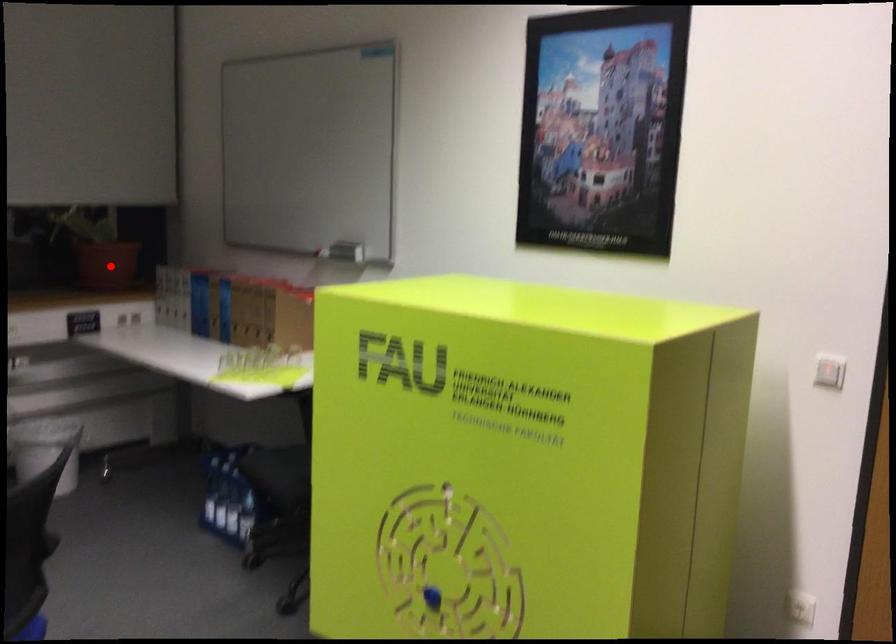
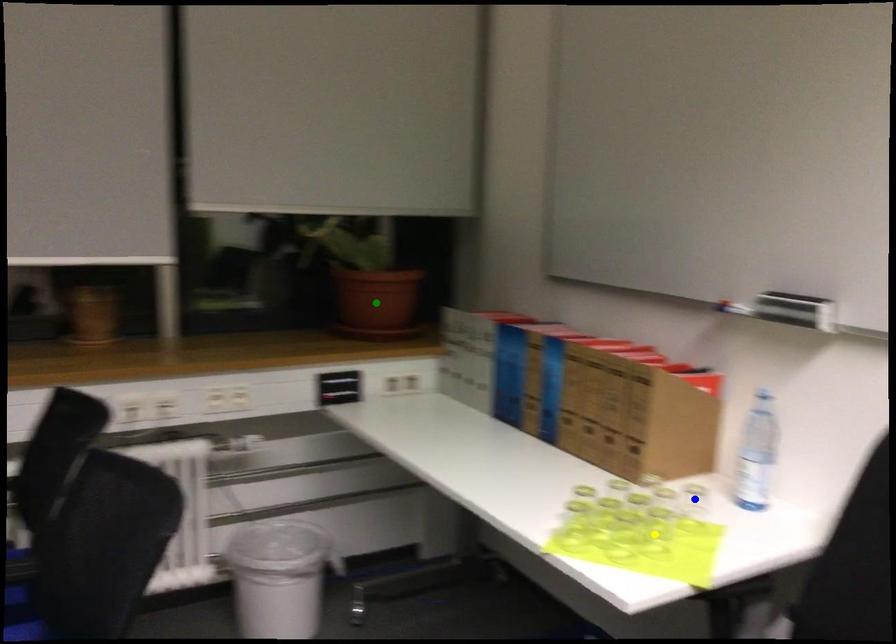
Question: I am providing you with two images of the same scene from different viewpoints. A red point is marked on the first image. You are given multiple points on the second image. In image 2, which mark is for the same physical point as the one in image 1?

Choices:
 (A) yellow point
 (B) green point
 (C) blue point

Answer: (B)